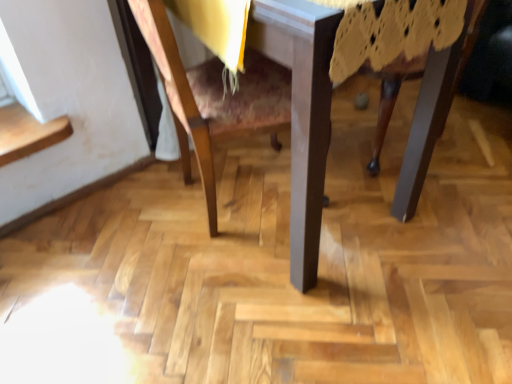
This screenshot has height=384, width=512. I want to click on wooden table at center, so click(x=302, y=113).

What do you see at coordinates (302, 113) in the screenshot? I see `wooden table at center` at bounding box center [302, 113].

Consider the image. Measure the distance between point (x=174, y=108) and camera.

Point (x=174, y=108) and camera are 3.48 feet apart.

You are a GUI agent. You are given a task and a screenshot of the screen. Output one action in this format:
    pyautogui.click(x=<x>, y=<y>)
    Task: Click on the wooden chair at center
    Image resolution: width=512 pixels, height=384 pixels.
    Given the screenshot: What is the action you would take?
    pyautogui.click(x=213, y=97)

This screenshot has height=384, width=512. Describe the element at coordinates (213, 97) in the screenshot. I see `wooden chair at center` at that location.

The image size is (512, 384). Find the location of `wooden table at center`. wooden table at center is located at coordinates (302, 113).

Which object is positioned more to the right, wooden table at center or wooden chair at center?

From the viewer's perspective, wooden table at center appears more on the right side.

Considering the relative positions of wooden table at center and wooden chair at center in the image provided, is wooden table at center behind wooden chair at center?

No, wooden table at center is in front of wooden chair at center.

Which is closer, [178,119] or [201,106]?

Point [178,119] is farther from the camera than point [201,106].

From the image's perspective, is wooden table at center above or below wooden chair at center?

From the image's perspective, wooden table at center appears above wooden chair at center.

From a real-world perspective, is wooden table at center under wooden chair at center?

No.

Between wooden table at center and wooden chair at center, which one has smaller width?

wooden chair at center.

Can you confirm if wooden table at center is shorter than wooden chair at center?

In fact, wooden table at center may be taller than wooden chair at center.

Can you confirm if wooden table at center is bigger than wooden chair at center?

Indeed, wooden table at center has a larger size compared to wooden chair at center.

Is wooden table at center inside the boundaries of wooden chair at center, or outside?

wooden table at center is spatially positioned inside wooden chair at center.

Is wooden table at center placed right next to wooden chair at center?

Yes, wooden table at center and wooden chair at center clearly make contact.

Looking at this image, does wooden table at center turn towards wooden chair at center?

Yes, wooden table at center is facing wooden chair at center.

What's the angular difference between wooden table at center and wooden chair at center's facing directions?

The angle between the facing direction of wooden table at center and the facing direction of wooden chair at center is 76.6 degrees.

The height and width of the screenshot is (384, 512). I want to click on table located above the wooden chair at center (from a real-world perspective), so click(x=302, y=113).

Which object is positioned more to the left, wooden chair at center or wooden table at center?

Positioned to the left is wooden chair at center.

Based on the photo, relative to wooden table at center, is wooden chair at center in front or behind?

Visually, wooden chair at center is located behind wooden table at center.

Which is closer, (x=233, y=117) or (x=154, y=10)?

The point (x=154, y=10) is more forward.

From the image's perspective, is wooden chair at center above or below wooden table at center?

Based on their image positions, wooden chair at center is located beneath wooden table at center.

From a real-world perspective, is wooden chair at center located beneath wooden table at center?

Yes, from a real-world perspective, wooden chair at center is beneath wooden table at center.

Considering the sizes of objects wooden chair at center and wooden table at center in the image provided, who is thinner, wooden chair at center or wooden table at center?

With smaller width is wooden chair at center.

Considering the sizes of objects wooden chair at center and wooden table at center in the image provided, who is shorter, wooden chair at center or wooden table at center?

wooden chair at center.

Based on the photo, does wooden chair at center have a smaller size compared to wooden table at center?

Yes.

Could wooden table at center be considered to be inside wooden chair at center?

Actually, wooden table at center is outside wooden chair at center.

Are wooden chair at center and wooden table at center beside each other?

Yes.

Is wooden chair at center oriented away from wooden table at center?

Yes, wooden chair at center is positioned with its back facing wooden table at center.

How many degrees apart are the facing directions of wooden chair at center and wooden table at center?

The facing directions of wooden chair at center and wooden table at center are 76.6 degrees apart.

Find the location of a particular element. Image resolution: width=512 pixels, height=384 pixels. chair on the left of wooden table at center is located at coordinates (x=213, y=97).

Locate an element on the screen. table in front of the wooden chair at center is located at coordinates (302, 113).

Locate an element on the screen. This screenshot has width=512, height=384. chair below the wooden table at center (from the image's perspective) is located at coordinates tap(213, 97).